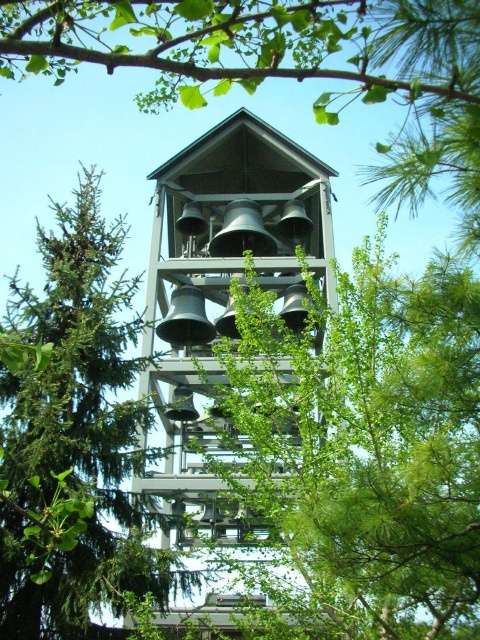
Question: Does green pine tree at center appear under metallic gray bells at center?

Choices:
 (A) no
 (B) yes

Answer: (A)

Question: Is green pine tree at center positioned in front of metallic gray bells at center?

Choices:
 (A) no
 (B) yes

Answer: (B)

Question: Which point appears closest to the camera in this image?

Choices:
 (A) (223, 122)
 (B) (73, 420)

Answer: (B)

Question: Does green pine tree at center appear over metallic gray bells at center?

Choices:
 (A) yes
 (B) no

Answer: (A)

Question: Which object appears closest to the camera in this image?

Choices:
 (A) metallic gray bells at center
 (B) green pine tree at center

Answer: (B)

Question: Which of the following is the farthest from the observer?

Choices:
 (A) green pine tree at center
 (B) metallic gray bells at center

Answer: (B)